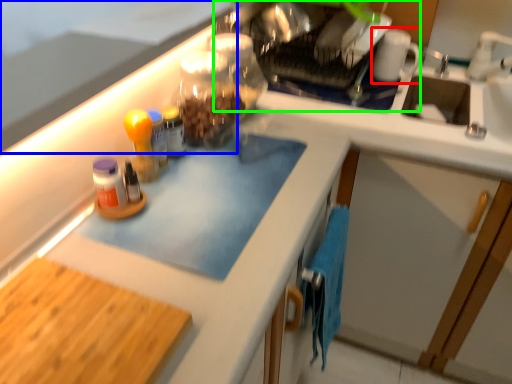
Question: Based on their relative distances, which object is nearer to mug (highlighted by a red box)? Choose from countertop (highlighted by a blue box) and appliance (highlighted by a green box).

Choices:
 (A) countertop
 (B) appliance

Answer: (B)